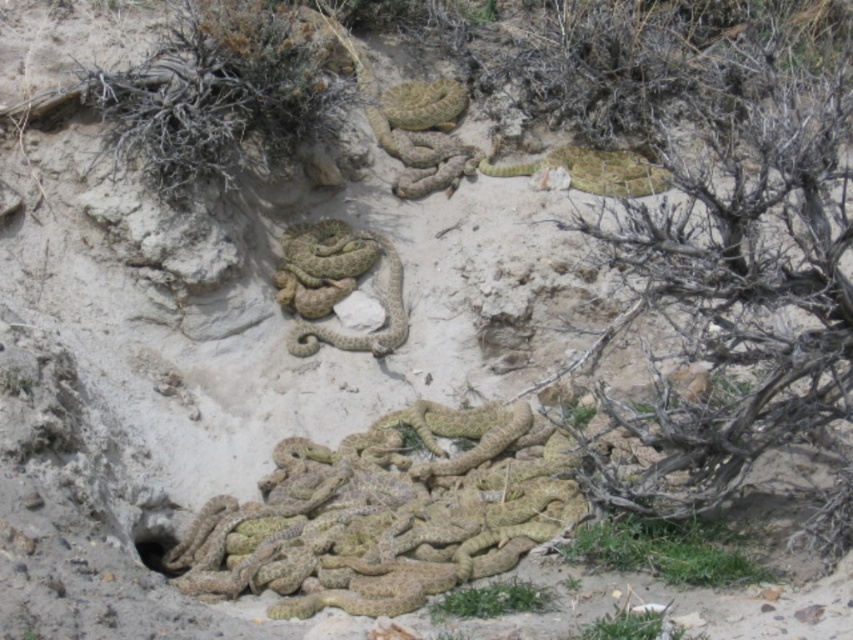
Is camouflage scales snakes at lower center further to the viewer compared to camouflage scales snake at center?

No.

Does camouflage scales snakes at lower center appear on the right side of camouflage scales snake at center?

Correct, you'll find camouflage scales snakes at lower center to the right of camouflage scales snake at center.

Between point (506, 440) and point (364, 262), which one is positioned behind?

Positioned behind is point (364, 262).

Locate an element on the screen. This screenshot has width=853, height=640. camouflage scales snakes at lower center is located at coordinates (386, 515).

The width and height of the screenshot is (853, 640). Find the location of `camouflage scales snakes at lower center`. camouflage scales snakes at lower center is located at coordinates (386, 515).

Is camouflage scales snakes at lower center wider than camouflage-patterned snake at upper right?

Correct, the width of camouflage scales snakes at lower center exceeds that of camouflage-patterned snake at upper right.

Is point (306, 472) less distant than point (639, 170)?

Yes, it is.

Find the location of `camouflage scales snakes at lower center`. camouflage scales snakes at lower center is located at coordinates (386, 515).

Does point (297, 259) come farther from viewer compared to point (572, 176)?

No, (297, 259) is closer to viewer.

Is point (289, 248) farther from camera compared to point (575, 170)?

No, it is not.

The height and width of the screenshot is (640, 853). Identify the location of camouflage scales snake at center. (335, 284).